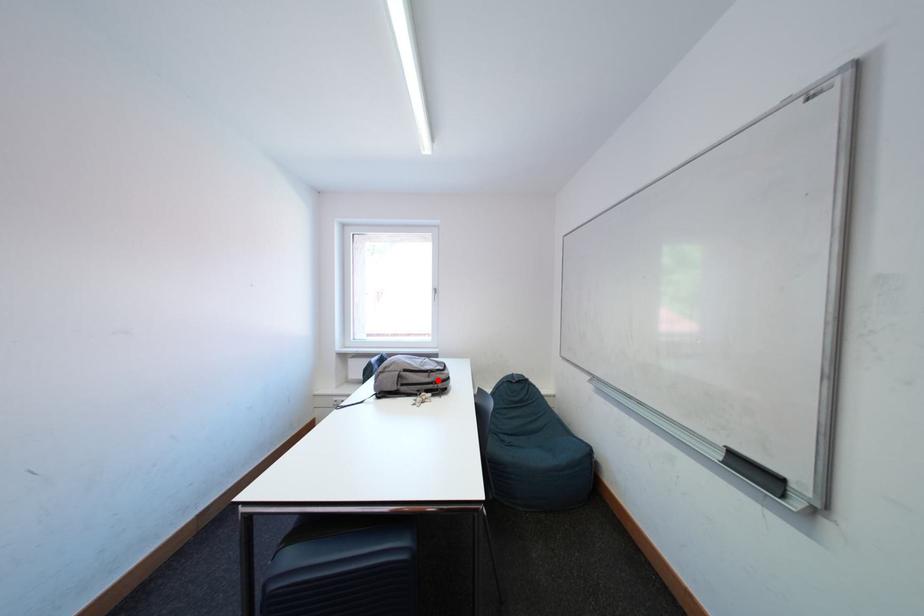
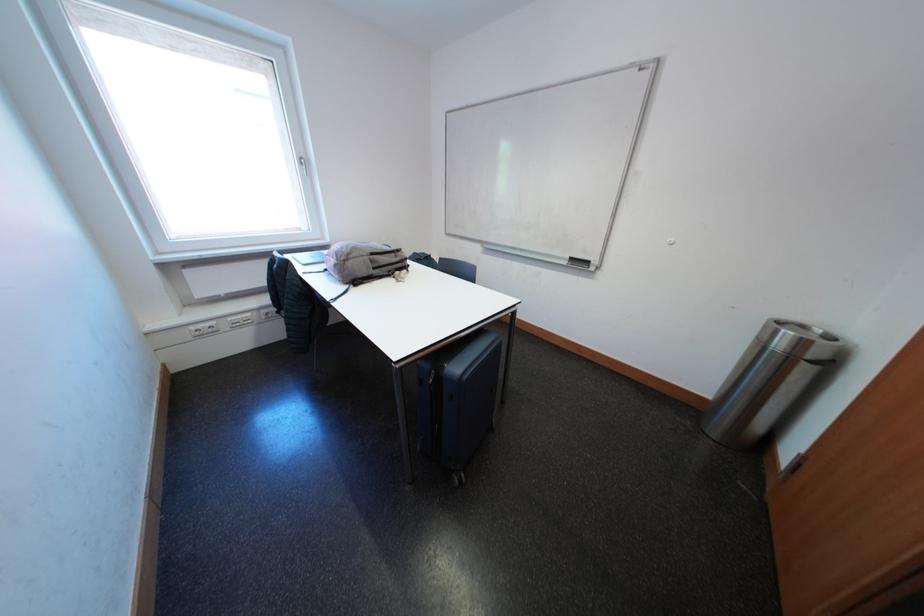
Question: A red point is marked in image1. In image2, is the corresponding 3D point closer to the camera or farther? Reply with the corresponding letter.

Choices:
 (A) The corresponding 3D point is closer.
 (B) The corresponding 3D point is farther.

Answer: (A)